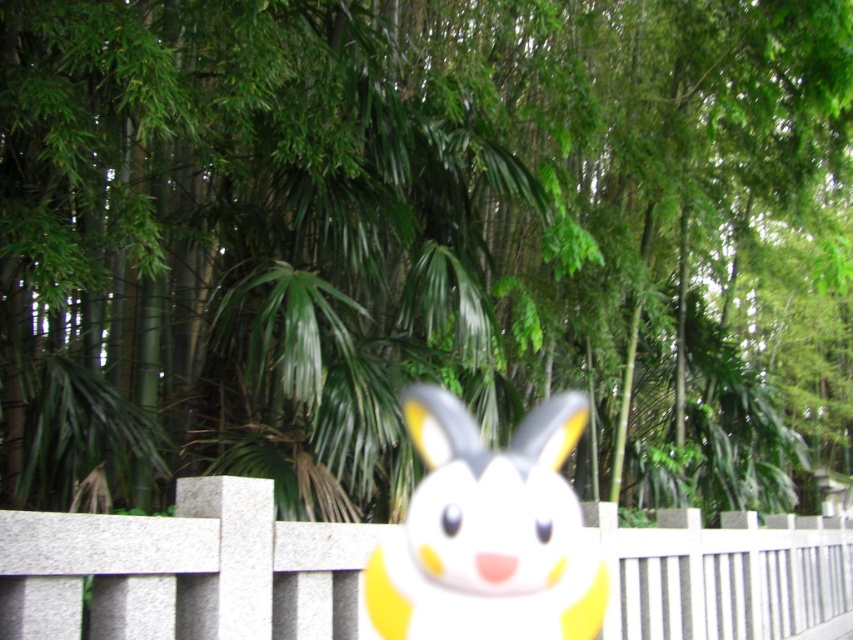
You are standing in the outdoor scene and see the white stone fence at center and the yellow matte bunny at center. Which object is positioned higher from the ground?

The white stone fence at center is located above the yellow matte bunny at center, so it is positioned higher from the ground.

You are a gardener who wants to place a new decorative item in the garden. You have a white stone fence at center and a yellow matte bunny at center. Which object is taller?

The yellow matte bunny at center is taller than the white stone fence at center.

You are standing in a garden and see the white stone fence at center and the yellow matte bunny at center. Which object is nearer to you?

The white stone fence at center is closer to the viewer than the yellow matte bunny at center.